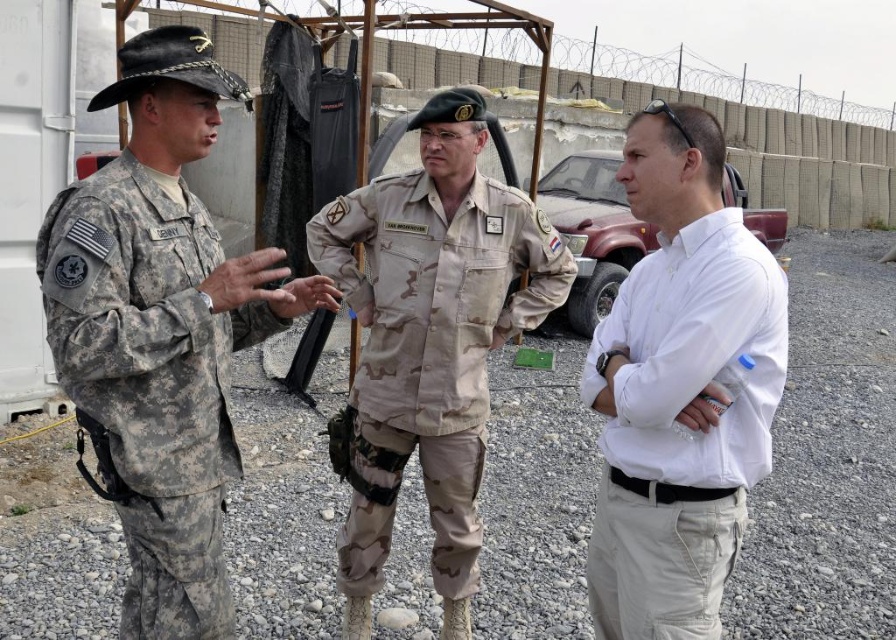
This screenshot has width=896, height=640. Identify the location of camouflage fabric uniform at left. (153, 378).

Can you confirm if camouflage fabric uniform at left is shorter than camouflage fabric uniform at center?

Yes, camouflage fabric uniform at left is shorter than camouflage fabric uniform at center.

Is point (254, 273) positioned after point (393, 401)?

No, it is not.

Image resolution: width=896 pixels, height=640 pixels. I want to click on camouflage fabric uniform at left, so click(153, 378).

Who is positioned more to the right, white cotton shirt at right or camouflage fabric uniform at left?

From the viewer's perspective, white cotton shirt at right appears more on the right side.

Between white cotton shirt at right and camouflage fabric uniform at left, which one is positioned higher?

white cotton shirt at right is higher up.

At what (x,y) coordinates should I click in order to perform the action: click on white cotton shirt at right. Please return your answer as a coordinate pair (x, y). The width and height of the screenshot is (896, 640). Looking at the image, I should click on (679, 388).

Where is `white cotton shirt at right`? The height and width of the screenshot is (640, 896). white cotton shirt at right is located at coordinates pos(679,388).

Can you confirm if white cotton shirt at right is thinner than camouflage fabric uniform at center?

Yes, white cotton shirt at right is thinner than camouflage fabric uniform at center.

Where is `white cotton shirt at right`? white cotton shirt at right is located at coordinates coord(679,388).